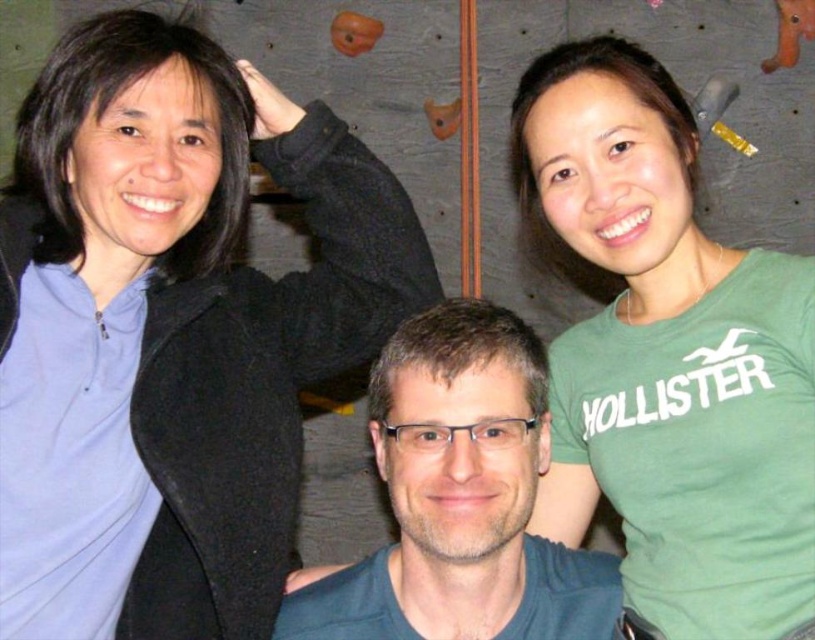
You are trying to decide which of the two items, the matte black sweater at upper left or the dark blue fabric at center, would be better to use as a makeshift seat cushion. Considering their widths, which one would you choose?

The matte black sweater at upper left might be wider than dark blue fabric at center, so it would likely provide a more comfortable and stable surface for sitting.